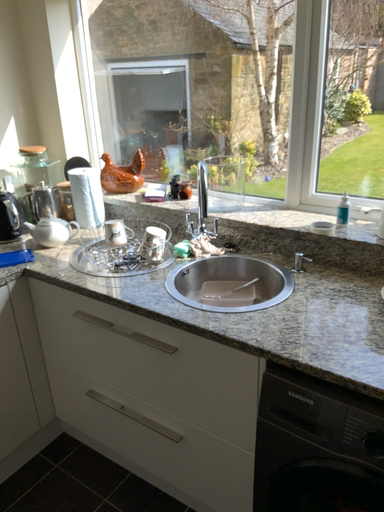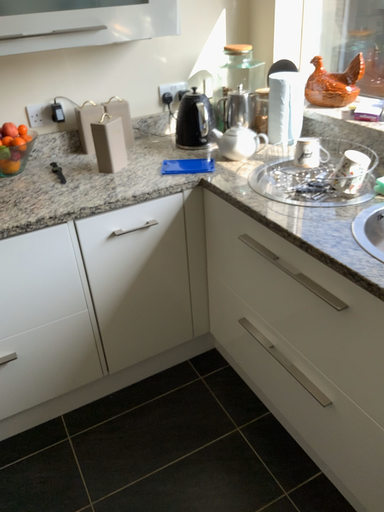
Question: How did the camera likely rotate when shooting the video?

Choices:
 (A) rotated right
 (B) rotated left

Answer: (B)